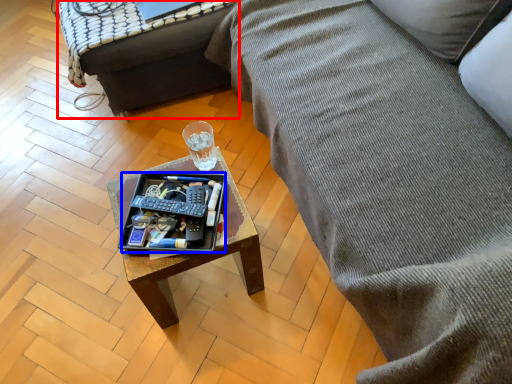
Question: Which point is closer to the camera, table (highlighted by a red box) or tray (highlighted by a blue box)?

Choices:
 (A) table
 (B) tray

Answer: (B)